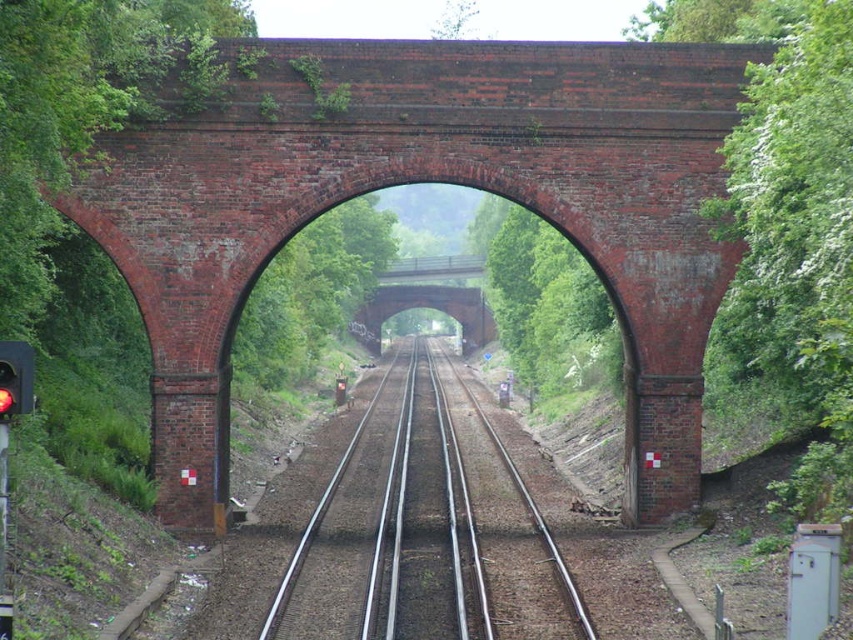
Question: Which object is farther from the camera taking this photo?

Choices:
 (A) brick arch bridge at center
 (B) metallic smooth train track at center
 (C) red brick bridge at center
 (D) red glass traffic light at left

Answer: (A)

Question: Is metallic smooth train track at center smaller than red glass traffic light at left?

Choices:
 (A) yes
 (B) no

Answer: (B)

Question: Which point is farther from the camera taking this photo?

Choices:
 (A) [x=509, y=164]
 (B) [x=444, y=273]
 (C) [x=409, y=429]

Answer: (B)

Question: Does metallic smooth train track at center appear on the right side of brick arch bridge at center?

Choices:
 (A) yes
 (B) no

Answer: (A)

Question: Which object is closer to the camera taking this photo?

Choices:
 (A) red glass traffic light at left
 (B) metallic smooth train track at center
 (C) red brick bridge at center

Answer: (A)

Question: Does red brick bridge at center come in front of brick arch bridge at center?

Choices:
 (A) yes
 (B) no

Answer: (A)